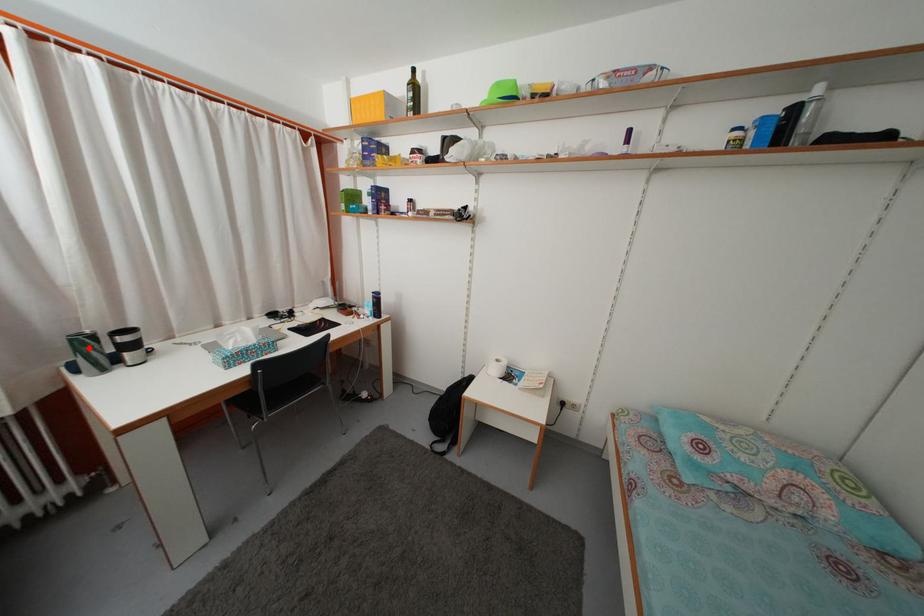
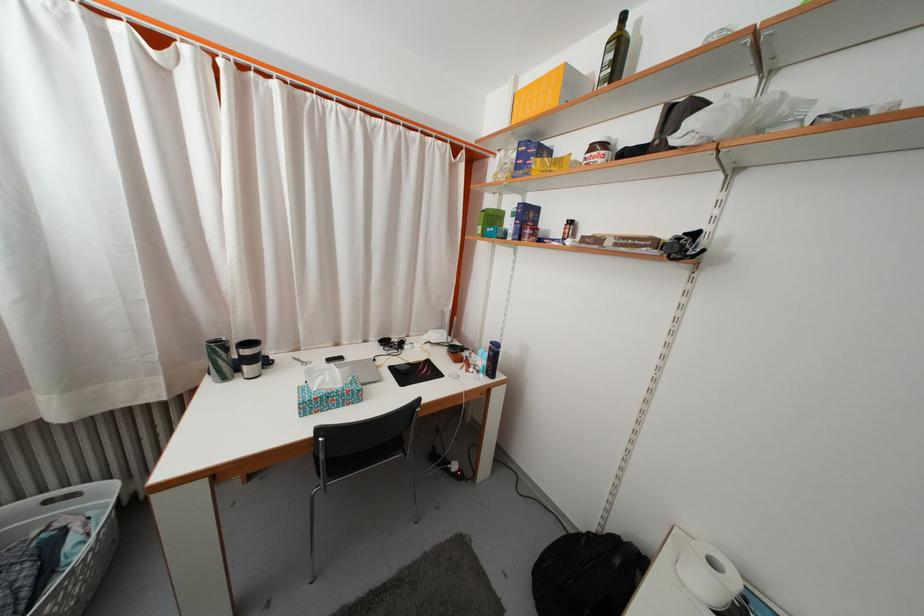
Where in the second image is the point corresponding to the highlighted location from the first image?

(225, 354)